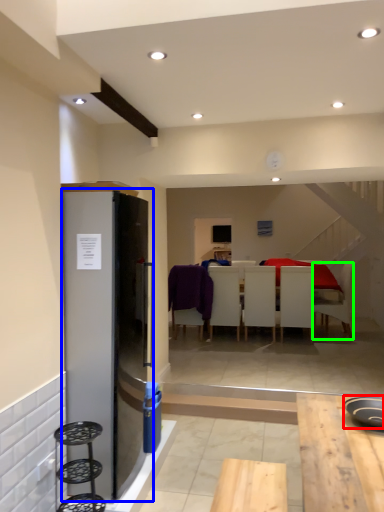
Question: Estimate the real-world distances between objects in this image. Which object is closer to appliance (highlighted by a red box), fridge (highlighted by a blue box) or chair (highlighted by a green box)?

Choices:
 (A) fridge
 (B) chair

Answer: (A)